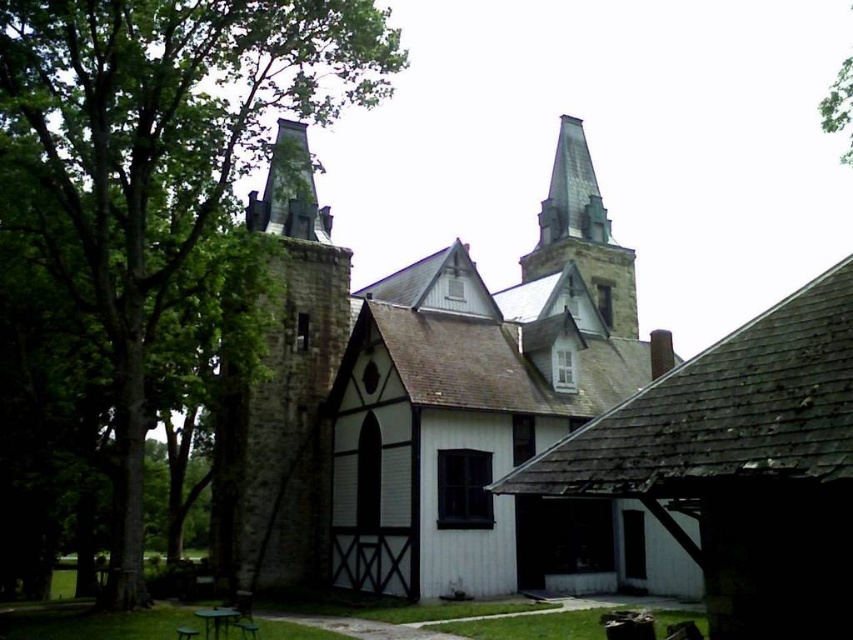
Question: Does green leafy tree at left have a larger size compared to gray stone steeple at upper center?

Choices:
 (A) no
 (B) yes

Answer: (B)

Question: Does stone church at center have a smaller size compared to green leafy tree at left?

Choices:
 (A) yes
 (B) no

Answer: (A)

Question: Where is stone church at center located in relation to green leafy tree at left in the image?

Choices:
 (A) above
 (B) below

Answer: (B)

Question: Which of the following is the closest to the observer?

Choices:
 (A) stone church at center
 (B) green leafy tree at left

Answer: (B)

Question: Which object appears closest to the camera in this image?

Choices:
 (A) stone church at center
 (B) green leafy tree at left
 (C) gray stone steeple at upper center

Answer: (B)

Question: Estimate the real-world distances between objects in this image. Which object is farther from the gray stone steeple at upper center?

Choices:
 (A) stone church at center
 (B) green leafy tree at left

Answer: (B)